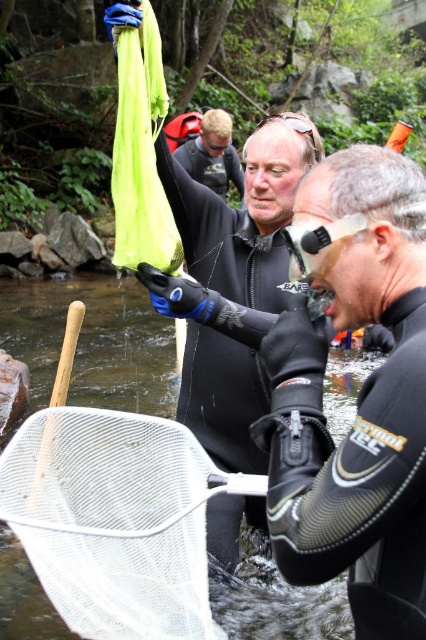
Does black neoprene wetsuit at center have a greater width compared to black wetsuit at center?

Incorrect, black neoprene wetsuit at center's width does not surpass black wetsuit at center's.

Which of these two, black neoprene wetsuit at center or black wetsuit at center, stands shorter?

black wetsuit at center is shorter.

Where is `black neoprene wetsuit at center`? The width and height of the screenshot is (426, 640). black neoprene wetsuit at center is located at coordinates (357, 400).